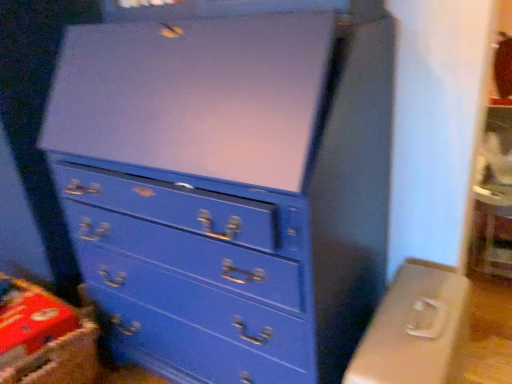
The width and height of the screenshot is (512, 384). Find the location of `matte blue dresser at center`. matte blue dresser at center is located at coordinates (229, 182).

Describe the element at coordinates (229, 182) in the screenshot. I see `matte blue dresser at center` at that location.

The width and height of the screenshot is (512, 384). I want to click on red cardboard crate at lower left, so click(44, 339).

From a real-world perspective, does matte plastic computer desk at lower right sit lower than matte blue dresser at center?

Yes, from a real-world perspective, matte plastic computer desk at lower right is below matte blue dresser at center.

Looking at this image, measure the distance between matte plastic computer desk at lower right and matte blue dresser at center.

matte plastic computer desk at lower right and matte blue dresser at center are 15.78 inches apart from each other.

Would you say matte blue dresser at center is part of matte plastic computer desk at lower right's contents?

Actually, matte blue dresser at center is outside matte plastic computer desk at lower right.

Looking at their sizes, would you say matte plastic computer desk at lower right is wider or thinner than matte blue dresser at center?

matte plastic computer desk at lower right is thinner than matte blue dresser at center.

Which is in front, red cardboard crate at lower left or matte blue dresser at center?

matte blue dresser at center is more forward.

Is red cardboard crate at lower left in contact with matte blue dresser at center?

red cardboard crate at lower left is not next to matte blue dresser at center, and they're not touching.

Looking at their sizes, would you say red cardboard crate at lower left is wider or thinner than matte blue dresser at center?

In the image, red cardboard crate at lower left appears to be more narrow than matte blue dresser at center.

From a real-world perspective, who is located lower, red cardboard crate at lower left or matte blue dresser at center?

From a 3D spatial view, red cardboard crate at lower left is below.

Is matte plastic computer desk at lower right at the back of matte blue dresser at center?

matte blue dresser at center does not have its back to matte plastic computer desk at lower right.

Is matte plastic computer desk at lower right inside matte blue dresser at center?

Actually, matte plastic computer desk at lower right is outside matte blue dresser at center.

Is matte blue dresser at center thinner than matte plastic computer desk at lower right?

No.

Does matte blue dresser at center lie behind matte plastic computer desk at lower right?

No, it is in front of matte plastic computer desk at lower right.

What's the angular difference between matte plastic computer desk at lower right and red cardboard crate at lower left's facing directions?

matte plastic computer desk at lower right and red cardboard crate at lower left are facing 85.3 degrees away from each other.

Considering the sizes of matte plastic computer desk at lower right and red cardboard crate at lower left in the image, is matte plastic computer desk at lower right bigger or smaller than red cardboard crate at lower left?

In the image, matte plastic computer desk at lower right appears to be larger than red cardboard crate at lower left.

From the image's perspective, is matte plastic computer desk at lower right on red cardboard crate at lower left?

No, from the image's perspective, matte plastic computer desk at lower right is not above red cardboard crate at lower left.

Do you think matte plastic computer desk at lower right is within red cardboard crate at lower left, or outside of it?

matte plastic computer desk at lower right is outside red cardboard crate at lower left.

In the scene shown: Between red cardboard crate at lower left and matte plastic computer desk at lower right, which one has larger width?

With larger width is matte plastic computer desk at lower right.

From the picture: From a real-world perspective, which is physically above, red cardboard crate at lower left or matte plastic computer desk at lower right?

From a 3D spatial view, red cardboard crate at lower left is above.

Is red cardboard crate at lower left bigger than matte plastic computer desk at lower right?

No, red cardboard crate at lower left is not bigger than matte plastic computer desk at lower right.

From the image's perspective, is red cardboard crate at lower left located above or below matte plastic computer desk at lower right?

Clearly, from the image's perspective, red cardboard crate at lower left is above matte plastic computer desk at lower right.

Considering the positions of objects matte blue dresser at center and red cardboard crate at lower left in the image provided, who is behind, matte blue dresser at center or red cardboard crate at lower left?

red cardboard crate at lower left is more distant.

Based on the photo, are matte blue dresser at center and red cardboard crate at lower left beside each other?

They are not placed beside each other.

Would you say matte blue dresser at center is inside or outside red cardboard crate at lower left?

matte blue dresser at center cannot be found inside red cardboard crate at lower left.

Locate an element on the screen. crate located on the left of matte blue dresser at center is located at coordinates (44, 339).

Find the location of a particular element. The width and height of the screenshot is (512, 384). computer desk below the matte blue dresser at center (from the image's perspective) is located at coordinates (416, 329).

Where is `crate lying behind the matte blue dresser at center`? crate lying behind the matte blue dresser at center is located at coordinates (44, 339).

Based on their spatial positions, is matte blue dresser at center or red cardboard crate at lower left further from matte plastic computer desk at lower right?

Among the two, red cardboard crate at lower left is located further to matte plastic computer desk at lower right.

Looking at the image, which one is located further to red cardboard crate at lower left, matte blue dresser at center or matte plastic computer desk at lower right?

matte plastic computer desk at lower right is further to red cardboard crate at lower left.

Estimate the real-world distances between objects in this image. Which object is closer to red cardboard crate at lower left, matte plastic computer desk at lower right or matte blue dresser at center?

Based on the image, matte blue dresser at center appears to be nearer to red cardboard crate at lower left.

Which object lies nearer to the anchor point matte plastic computer desk at lower right, red cardboard crate at lower left or matte blue dresser at center?

Based on the image, matte blue dresser at center appears to be nearer to matte plastic computer desk at lower right.

When comparing their distances from matte blue dresser at center, does matte plastic computer desk at lower right or red cardboard crate at lower left seem closer?

matte plastic computer desk at lower right lies closer to matte blue dresser at center than the other object.

Looking at the image, which one is located closer to matte blue dresser at center, red cardboard crate at lower left or matte plastic computer desk at lower right?

Among the two, matte plastic computer desk at lower right is located nearer to matte blue dresser at center.

Where is `the chest of drawers situated between red cardboard crate at lower left and matte plastic computer desk at lower right from left to right`? Image resolution: width=512 pixels, height=384 pixels. the chest of drawers situated between red cardboard crate at lower left and matte plastic computer desk at lower right from left to right is located at coordinates (229, 182).